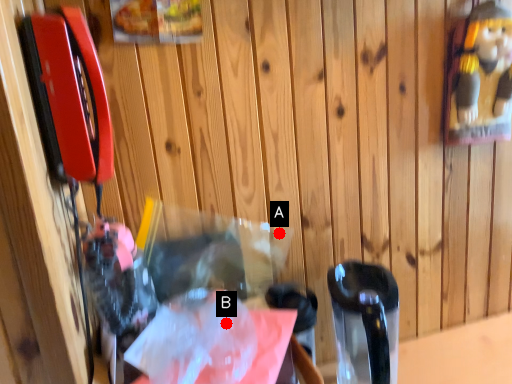
Question: Two points are circled on the image, labeled by A and B beside each circle. Which point is closer to the camera taking this photo?

Choices:
 (A) A is closer
 (B) B is closer

Answer: (B)